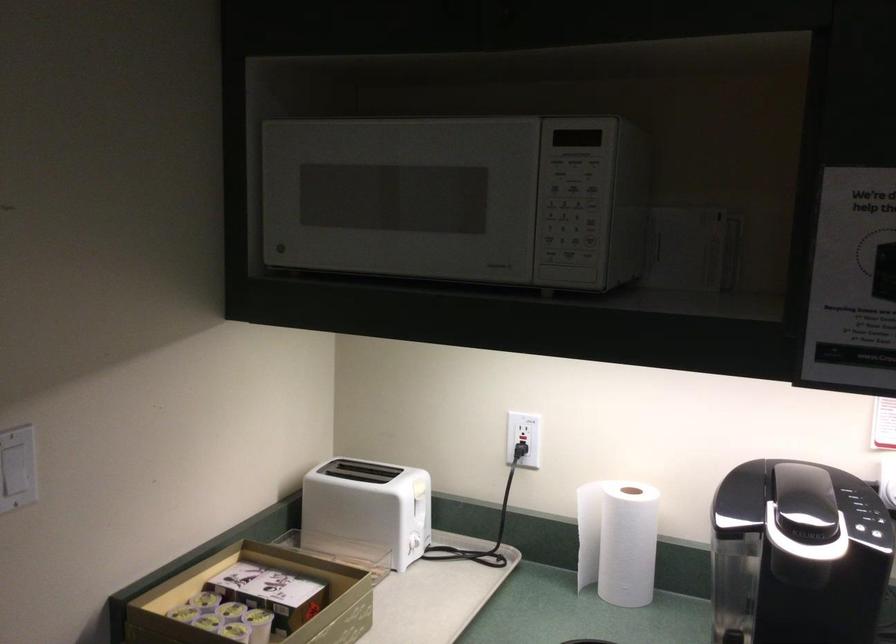
Where would you push the microwave keypad button? Please return your answer as a coordinate pair (x, y).

(569, 220)